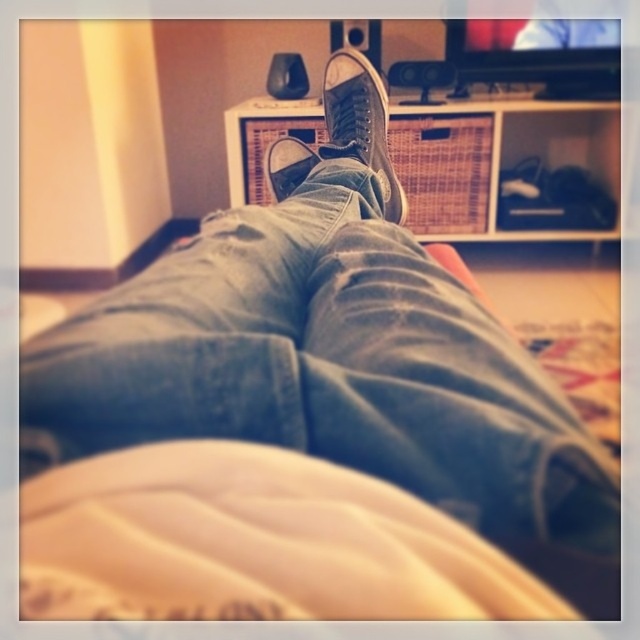
You are trying to determine the distance between two points in the image. The first point is labeled as point (412, 186) and the second is point (268, 161). According to the description, which point is closer to the camera?

Point (268, 161) is closer to the camera because the description states that point (412, 186) is further away than point (268, 161).

Based on the scene described, where is the point located at coordinates (x=502, y=168)?

The point at coordinates (x=502, y=168) corresponds to the woven wood cabinet at upper center.

You are trying to find a place to put your keys. You have two options in the image provided. One is the woven wood cabinet at upper center and the other is the matte black shoe at center. Which location is higher up and thus more suitable for placing keys?

The woven wood cabinet at upper center is located above the matte black shoe at center, so it is higher up and more suitable for placing keys.